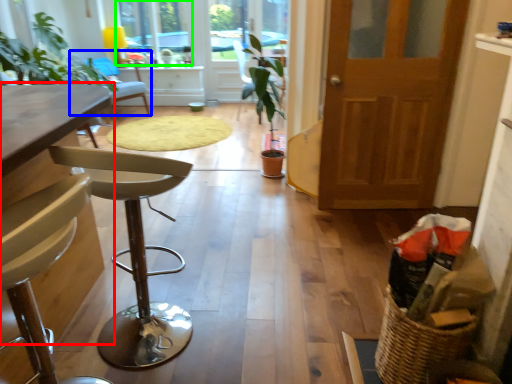
Question: Estimate the real-world distances between objects in this image. Which object is farther from table (highlighted by a red box), chair (highlighted by a blue box) or window (highlighted by a green box)?

Choices:
 (A) chair
 (B) window

Answer: (B)